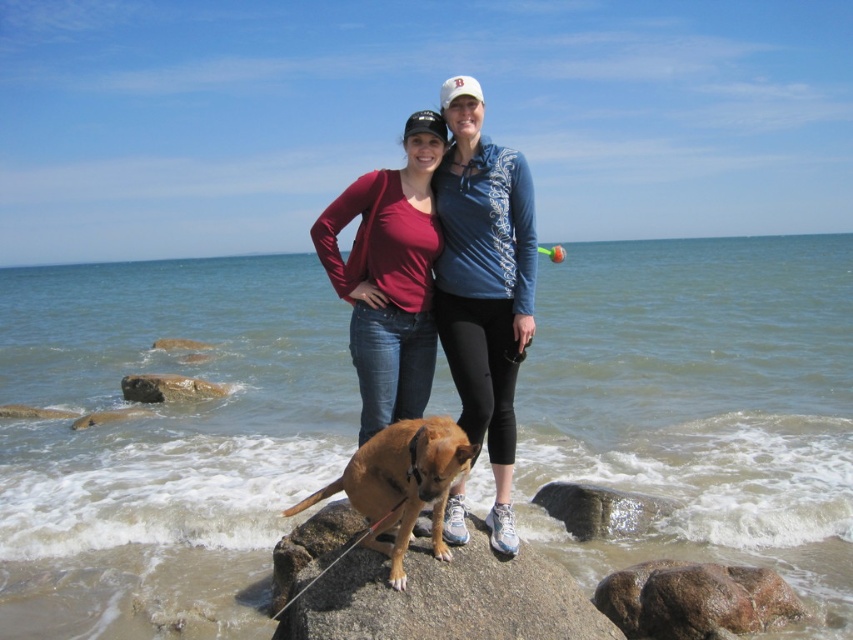
You are a photographer trying to capture a group photo of the matte red shirt at center and the smooth gray rock at lower left. Since you want both subjects to appear equally sized in the photo, which subject should you move closer to the camera?

You should move the smooth gray rock at lower left closer to the camera because the matte red shirt at center is wider than the smooth gray rock at lower left. To make them appear the same size in the photo, the smaller object needs to be moved closer.

You are standing at the point labeled as point [389,275] in the image. Looking around, you see a matte red shirt at center and a small brown dog between two people. Which object is closer to you?

The point labeled as point [389,275] corresponds to the matte red shirt at center, so the matte red shirt at center is right at your current position.

You are a photographer trying to capture a candid shot of the matte blue hoodie at center and the brown smooth rock at center. Since you want to ensure both subjects are in focus, you need to know their positions relative to each other. Which object is positioned to the right of the other?

The matte blue hoodie at center is to the right of the brown smooth rock at center.